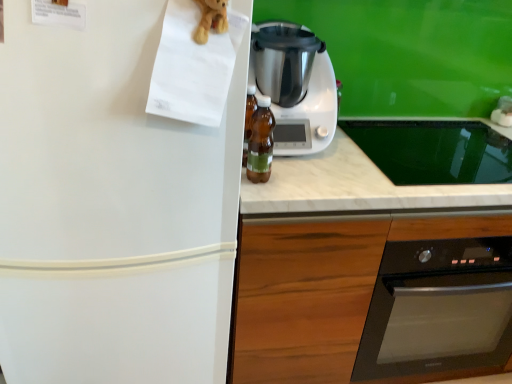
Question: Can you confirm if white plastic blender at center is smaller than translucent amber bottle at center?

Choices:
 (A) no
 (B) yes

Answer: (A)

Question: Is white plastic blender at center turned away from translucent amber bottle at center?

Choices:
 (A) yes
 (B) no

Answer: (B)

Question: Can you confirm if white plastic blender at center is bigger than translucent amber bottle at center?

Choices:
 (A) yes
 (B) no

Answer: (A)

Question: Is white plastic blender at center next to translucent amber bottle at center and touching it?

Choices:
 (A) yes
 (B) no

Answer: (B)

Question: From the image's perspective, would you say white plastic blender at center is positioned over translucent amber bottle at center?

Choices:
 (A) no
 (B) yes

Answer: (B)

Question: Is white plastic blender at center shorter than translucent amber bottle at center?

Choices:
 (A) no
 (B) yes

Answer: (A)

Question: From the image's perspective, is wooden at center below translucent amber bottle at center?

Choices:
 (A) yes
 (B) no

Answer: (A)

Question: From a real-world perspective, is wooden at center beneath translucent amber bottle at center?

Choices:
 (A) no
 (B) yes

Answer: (B)

Question: Could you tell me if wooden at center is turned towards translucent amber bottle at center?

Choices:
 (A) no
 (B) yes

Answer: (A)

Question: Can you confirm if wooden at center is shorter than translucent amber bottle at center?

Choices:
 (A) no
 (B) yes

Answer: (A)

Question: Is wooden at center in front of translucent amber bottle at center?

Choices:
 (A) yes
 (B) no

Answer: (B)

Question: Is wooden at center positioned with its back to translucent amber bottle at center?

Choices:
 (A) yes
 (B) no

Answer: (B)

Question: Considering the relative sizes of white matte refrigerator at left and wooden at center in the image provided, is white matte refrigerator at left thinner than wooden at center?

Choices:
 (A) yes
 (B) no

Answer: (B)